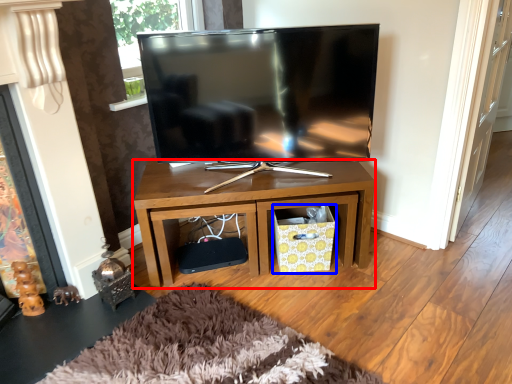
Question: Which point is further to the camera, desk (highlighted by a red box) or crate (highlighted by a blue box)?

Choices:
 (A) desk
 (B) crate

Answer: (B)